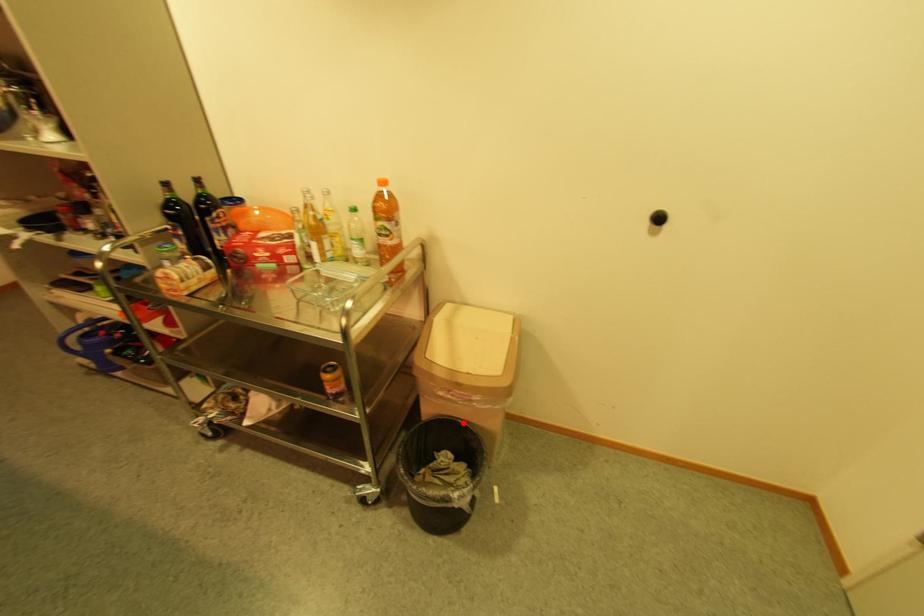
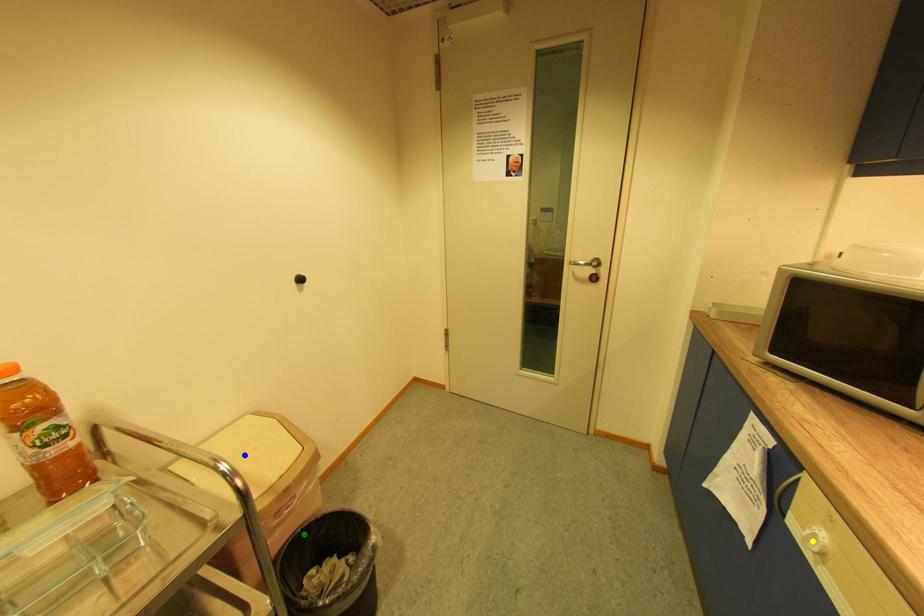
Question: I am providing you with two images of the same scene from different viewpoints. A red point is marked on the first image. You are given multiple points on the second image. Which point in image 2 is actually the same real-world point as the red point in image 1?

Choices:
 (A) blue point
 (B) yellow point
 (C) green point

Answer: (C)